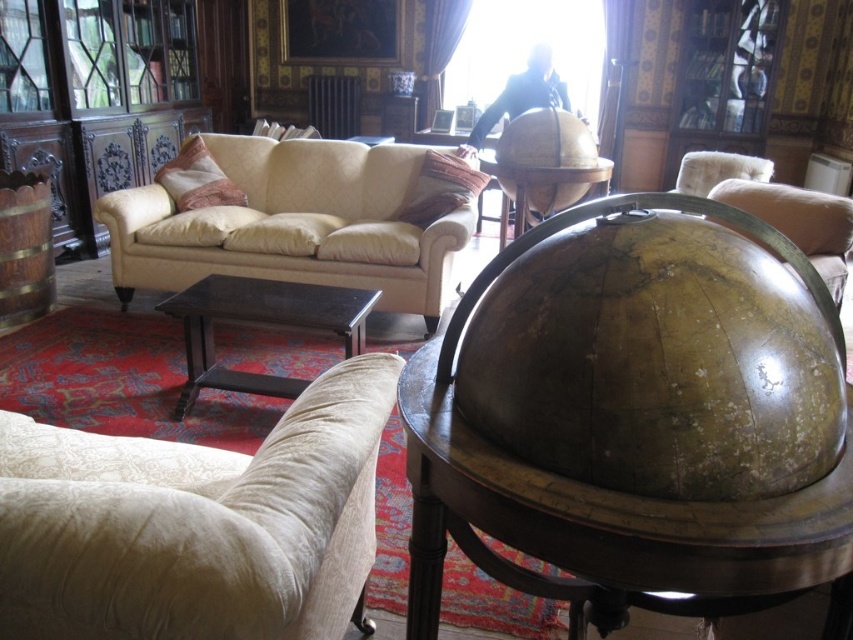
Based on the photo, you are planning to move a large painting that is 1.8 meters wide into this living room. The painting needs to be placed between the beige fabric couch at center and the wooden globe at center. Based on the space available, will the painting fit between them?

The beige fabric couch at center might be wider than wooden globe at center, so the distance between them may not be sufficient to accommodate the 1.8 meters wide painting. It is uncertain and requires further measurement.